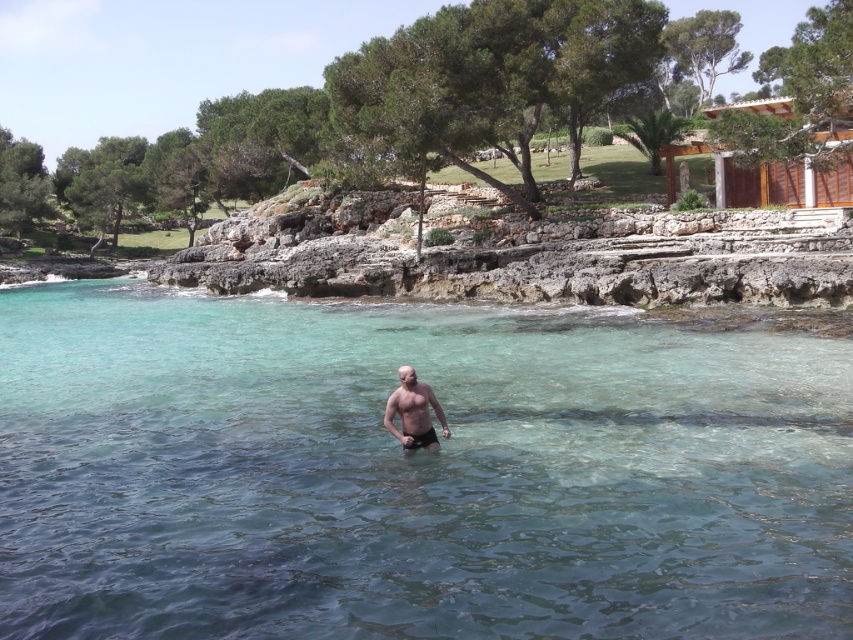
Which is more to the right, clear water at center or smooth skin man at center?

smooth skin man at center is more to the right.

Is clear water at center smaller than smooth skin man at center?

No.

Is point (654, 538) closer to camera compared to point (436, 444)?

Yes.

I want to click on clear water at center, so click(x=413, y=472).